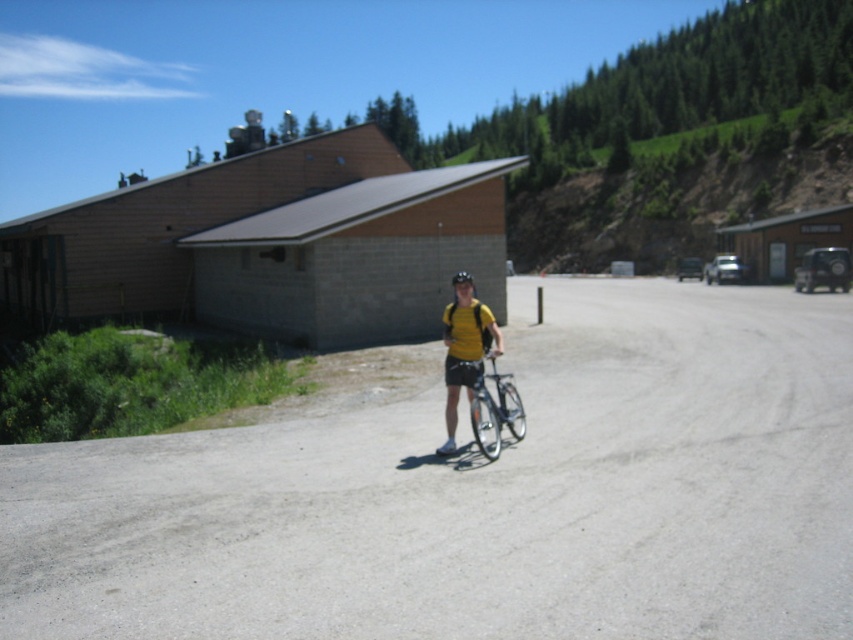
Which is above, gray asphalt at center or silver metallic bicycle at center?

Positioned higher is silver metallic bicycle at center.

Can you confirm if gray asphalt at center is smaller than silver metallic bicycle at center?

No.

Where is `gray asphalt at center`? The height and width of the screenshot is (640, 853). gray asphalt at center is located at coordinates (480, 492).

Who is higher up, gray asphalt at center or yellow matte shirt at center?

yellow matte shirt at center is above.

Does point (97, 467) come in front of point (454, 337)?

Yes, point (97, 467) is closer to viewer.

Where is `gray asphalt at center`? This screenshot has width=853, height=640. gray asphalt at center is located at coordinates (480, 492).

In order to click on gray asphalt at center in this screenshot , I will do `click(480, 492)`.

Between yellow matte shirt at center and black matte bicycle helmet at center, which one has more height?

Standing taller between the two is black matte bicycle helmet at center.

Locate an element on the screen. yellow matte shirt at center is located at coordinates (465, 352).